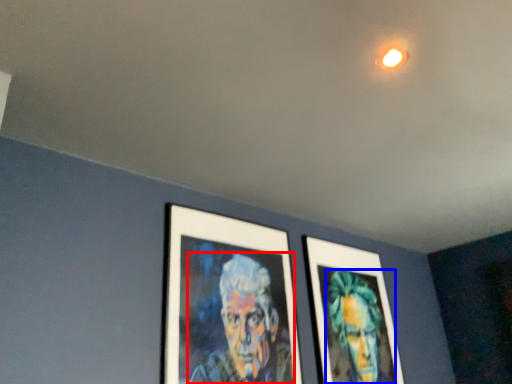
Question: Among these objects, which one is nearest to the camera, person (highlighted by a red box) or person (highlighted by a blue box)?

Choices:
 (A) person
 (B) person

Answer: (A)